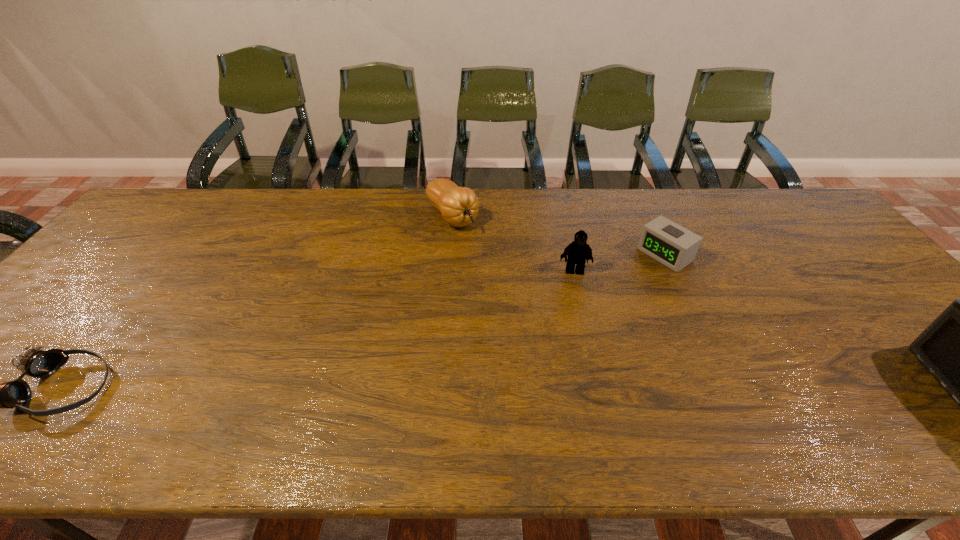
This screenshot has height=540, width=960. Find the location of `gourd`. gourd is located at coordinates [x=459, y=206].

Locate an element on the screen. The height and width of the screenshot is (540, 960). the farthest object is located at coordinates (459, 206).

The width and height of the screenshot is (960, 540). In order to click on the third object from right to left in this screenshot , I will do `click(578, 251)`.

The height and width of the screenshot is (540, 960). I want to click on alarm clock, so click(x=674, y=246).

At what (x,y) coordinates should I click in order to perform the action: click on the second object from right to left. Please return your answer as a coordinate pair (x, y). Image resolution: width=960 pixels, height=540 pixels. Looking at the image, I should click on (674, 246).

Identify the location of blank space located on the stem side of the second object from left to right. (492, 258).

Locate an element on the screen. Image resolution: width=960 pixels, height=540 pixels. free point located on the stem side of the second object from left to right is located at coordinates (526, 292).

Identify the location of free space located 0.180m on the stem side of the second object from left to right. The width and height of the screenshot is (960, 540). (499, 265).

I want to click on vacant position located 0.360m on the face of the Lego, so click(584, 386).

You are a GUI agent. You are given a task and a screenshot of the screen. Output one action in this format:
    pyautogui.click(x=<x>, y=<y>)
    Task: Click on the vacant space situated on the face of the Lego
    The image size is (960, 540).
    Given the screenshot: What is the action you would take?
    pyautogui.click(x=584, y=389)